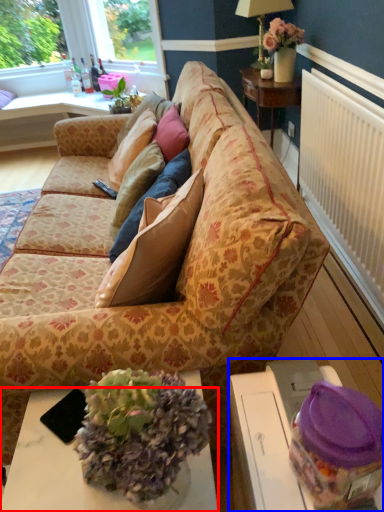
Question: Among these objects, which one is farthest to the camera, desk (highlighted by a red box) or table (highlighted by a blue box)?

Choices:
 (A) desk
 (B) table

Answer: (A)